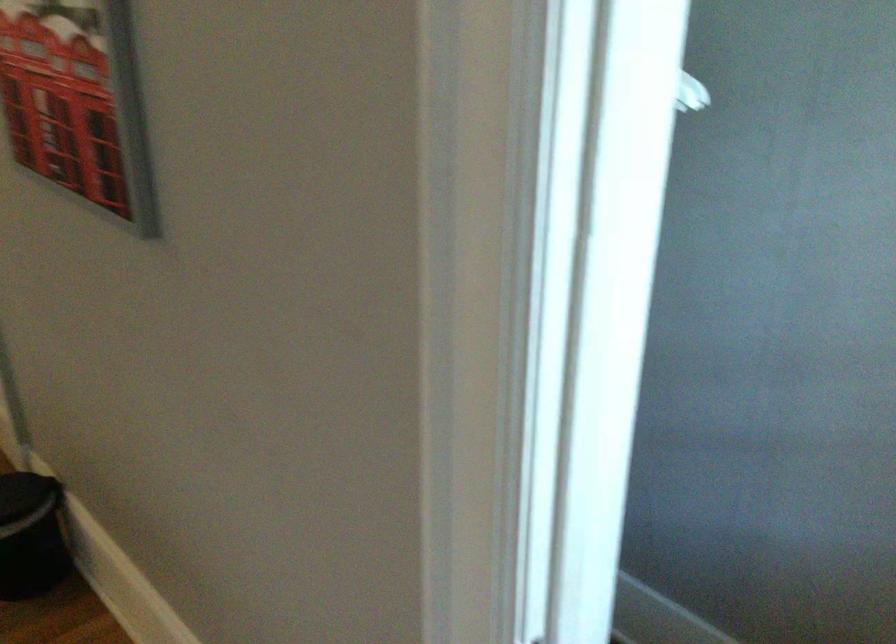
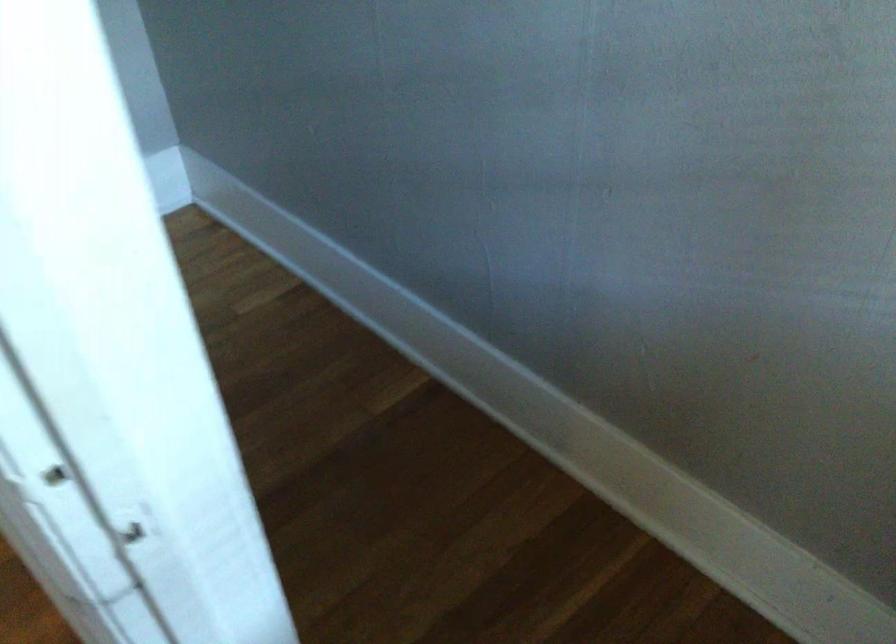
Question: How did the camera likely rotate?

Choices:
 (A) Left
 (B) Right
 (C) Up
 (D) Down

Answer: (D)